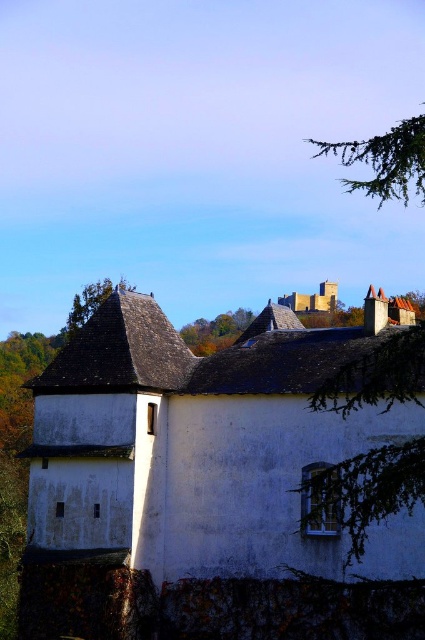
You are standing in the rural area and see the green leafy tree at upper center and the brown stone castle at upper center. Which one is closer to the sky?

The green leafy tree at upper center is positioned under brown stone castle at upper center, so the brown stone castle at upper center is closer to the sky.

You are standing in the rural scene and want to locate the green shingled roof at upper center. According to the coordinates provided, where exactly is it positioned?

The green shingled roof at upper center is located at point coordinates of 0.477 on the x axis and 0.202 on the y axis.

Looking at this image, you are standing in a field and see the white matte stone castle at center and the green leafy tree at upper center. Which object is nearer to you?

The white matte stone castle at center is closer to the viewer than the green leafy tree at upper center.